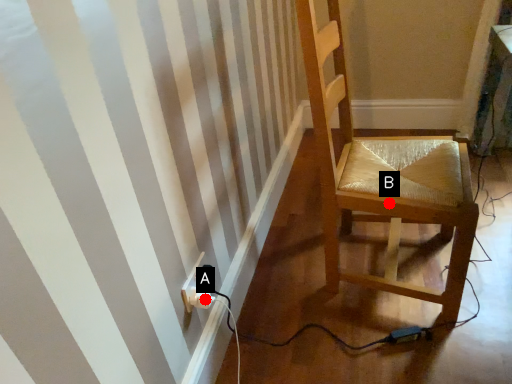
Question: Two points are circled on the image, labeled by A and B beside each circle. Which point is closer to the camera?

Choices:
 (A) A is closer
 (B) B is closer

Answer: (A)